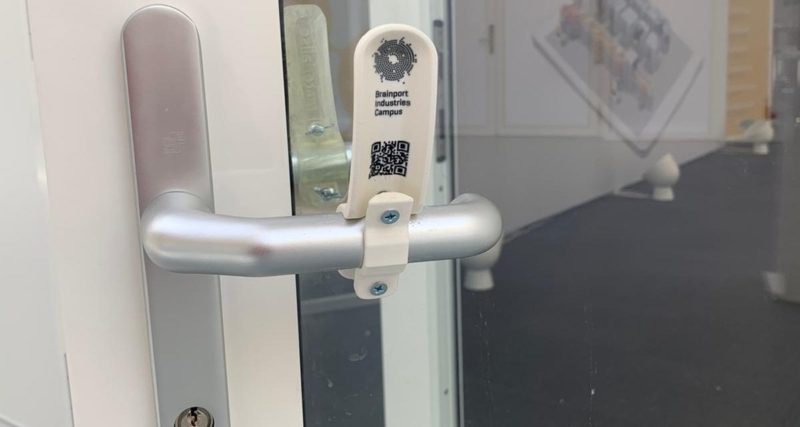
At what (x,y) coordinates should I click in order to perform the action: click on glass. Please return your answer as a coordinate pair (x, y). Looking at the image, I should click on click(x=628, y=238).